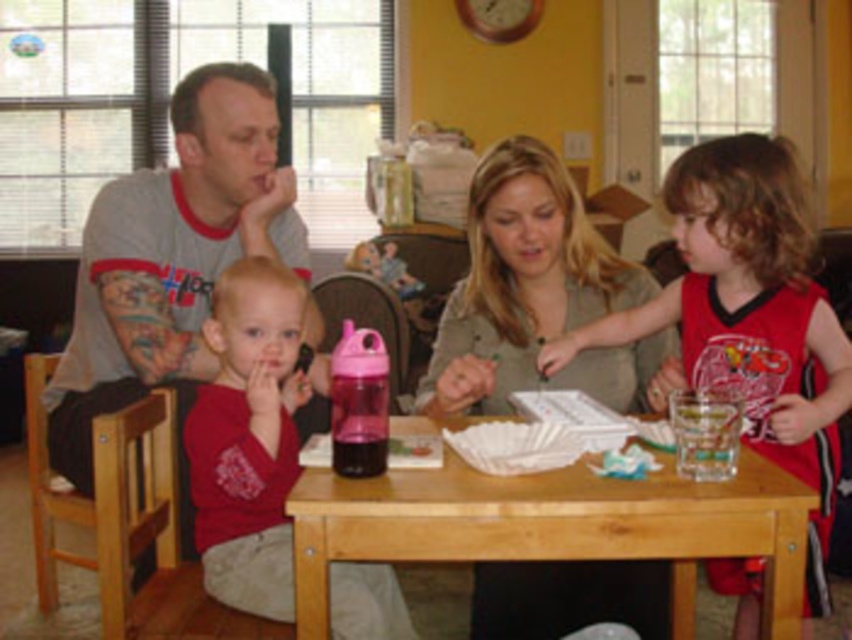
Question: Does gray cotton t-shirt at left have a larger size compared to red jersey shirt at right?

Choices:
 (A) no
 (B) yes

Answer: (A)

Question: Based on their relative distances, which object is nearer to the gray cotton t-shirt at left?

Choices:
 (A) red jersey shirt at right
 (B) matte gray shirt at center
 (C) wooden table at center
 (D) matte red shirt at center

Answer: (D)

Question: Which object is positioned farthest from the matte red shirt at center?

Choices:
 (A) gray cotton t-shirt at left
 (B) matte gray shirt at center

Answer: (A)

Question: From the image, what is the correct spatial relationship of matte gray shirt at center in relation to wooden table at center?

Choices:
 (A) above
 (B) below

Answer: (A)

Question: Does gray cotton t-shirt at left appear under red jersey shirt at right?

Choices:
 (A) no
 (B) yes

Answer: (A)

Question: Among these points, which one is farthest from the camera?

Choices:
 (A) (490, 346)
 (B) (827, 444)
 (C) (266, 605)
 (D) (170, 268)

Answer: (D)